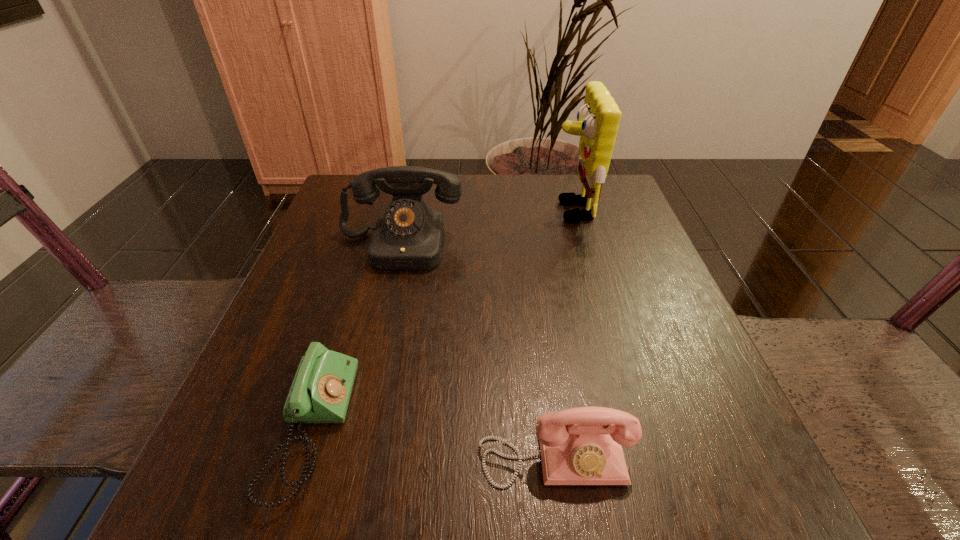
The height and width of the screenshot is (540, 960). Find the location of `free spot that satisfies the following two spatial constraints: 1. on the face of the tallest object; 2. on the dial of the tallest telephone`. free spot that satisfies the following two spatial constraints: 1. on the face of the tallest object; 2. on the dial of the tallest telephone is located at coordinates (581, 245).

Find the location of a particular element. vacant region that satisfies the following two spatial constraints: 1. on the face of the tallest object; 2. on the dial of the tallest telephone is located at coordinates (581, 245).

At what (x,y) coordinates should I click in order to perform the action: click on free location that satisfies the following two spatial constraints: 1. on the dial of the tallest telephone; 2. on the dial of the shortest telephone. Please return your answer as a coordinate pair (x, y). The height and width of the screenshot is (540, 960). Looking at the image, I should click on (358, 428).

Identify the location of free space that satisfies the following two spatial constraints: 1. on the face of the tallest object; 2. on the dial of the rightmost telephone. The width and height of the screenshot is (960, 540). (641, 455).